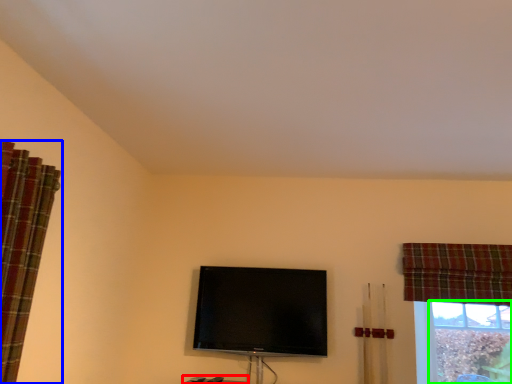
Question: Considering the real-world distances, which object is closest to furniture (highlighted by a red box)? curtain (highlighted by a blue box) or bay window (highlighted by a green box).

Choices:
 (A) curtain
 (B) bay window

Answer: (A)